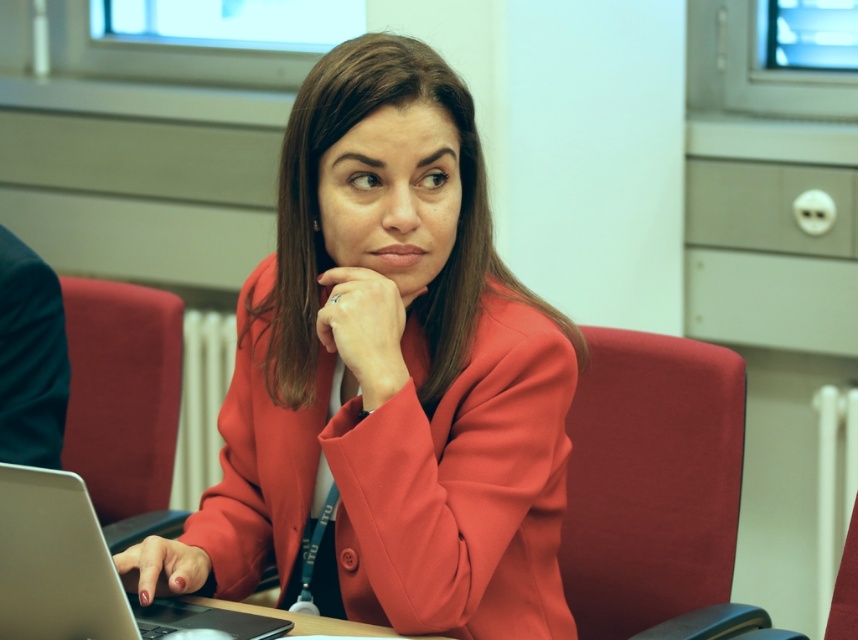
Question: Among these points, which one is farthest from the camera?

Choices:
 (A) (53, 611)
 (B) (286, 140)

Answer: (B)

Question: Does matte red blazer at center lie in front of silver metallic laptop at lower left?

Choices:
 (A) no
 (B) yes

Answer: (A)

Question: Where is matte red blazer at center located in relation to silver metallic laptop at lower left in the image?

Choices:
 (A) left
 (B) right

Answer: (B)

Question: Which of the following is the farthest from the observer?

Choices:
 (A) (14, 486)
 (B) (393, 316)

Answer: (B)

Question: Does matte red blazer at center have a larger size compared to silver metallic laptop at lower left?

Choices:
 (A) no
 (B) yes

Answer: (B)

Question: Among these points, which one is nearest to the camera?

Choices:
 (A) (529, 426)
 (B) (67, 602)

Answer: (B)